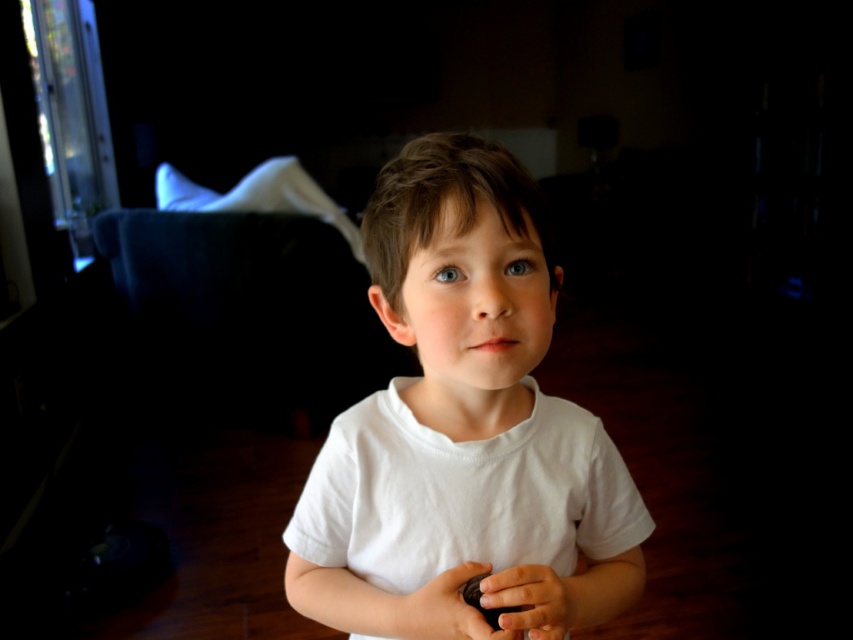
You are a tailor measuring a child for a new shirt. You notice the child is holding an object in their hand. Based on the image provided, can you determine if the width of the white cotton shirt at center is greater than the smooth brown object at center?

The white cotton shirt at center might be wider than smooth brown object at center according to the description, so there is a possibility that the shirt is wider. However, without exact measurements, this cannot be confirmed with certainty.

The child is holding an object in their hand. Based on the scene, can you determine if the smooth brown object at center is located to the left or right side of the smooth skin hand at center?

The smooth brown object at center is to the left of the smooth skin hand at center according to the description.